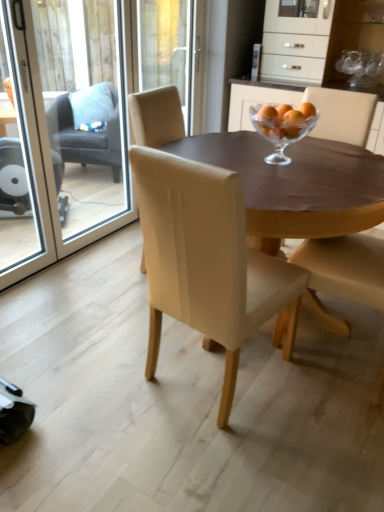
Locate an element on the screen. Image resolution: width=384 pixels, height=512 pixels. free space above matte brown table at center (from a real-world perspective) is located at coordinates (274, 151).